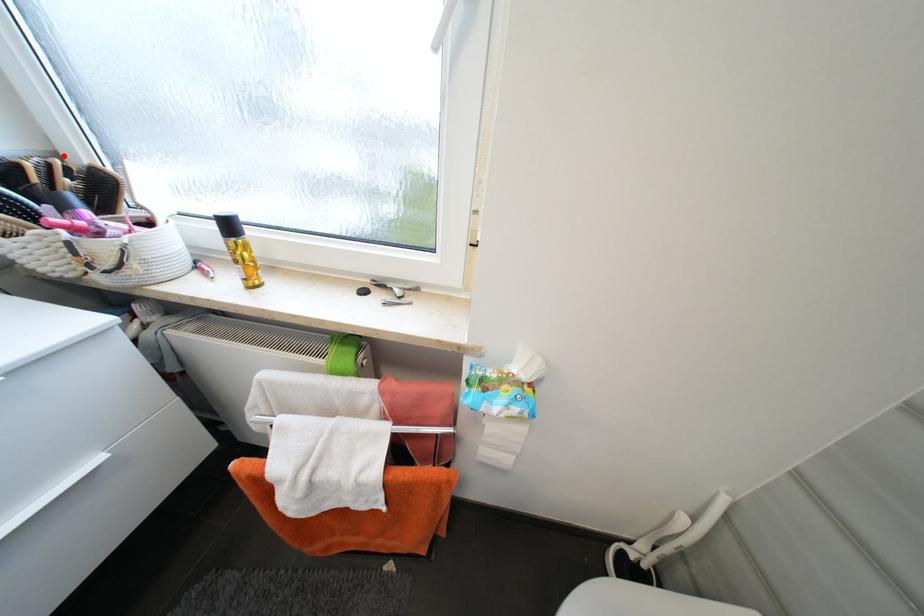
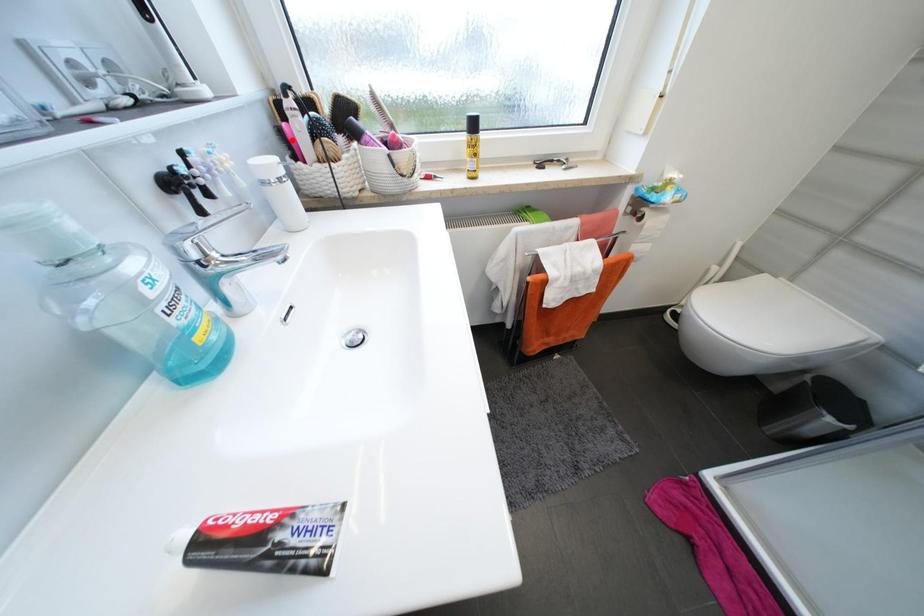
I am providing you with two images of the same scene from different viewpoints. A red point is marked on the first image and another point is marked on the second image. Does the point marked in image1 correspond to the same location as the one in image2?

No